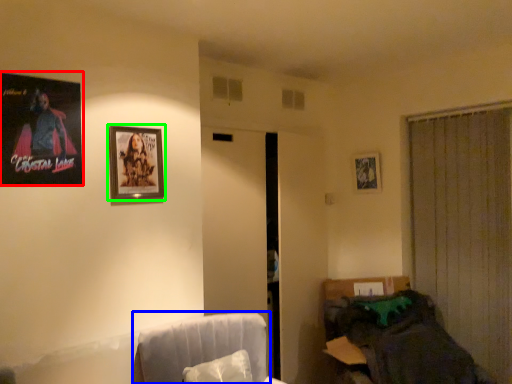
Question: Estimate the real-world distances between objects in this image. Which object is closer to picture frame (highlighted by a red box), swivel chair (highlighted by a blue box) or picture frame (highlighted by a green box)?

Choices:
 (A) swivel chair
 (B) picture frame

Answer: (B)